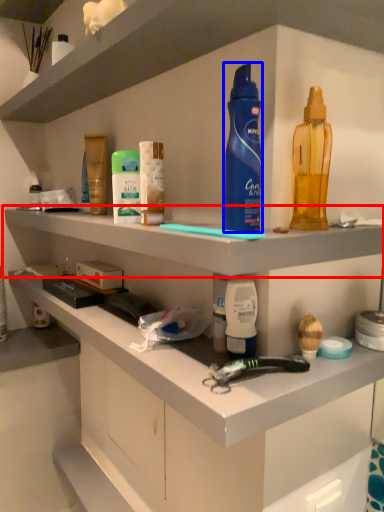
Question: Which object appears closest to the camera in this image, shelf (highlighted by a red box) or cleaning product (highlighted by a blue box)?

Choices:
 (A) shelf
 (B) cleaning product

Answer: (A)